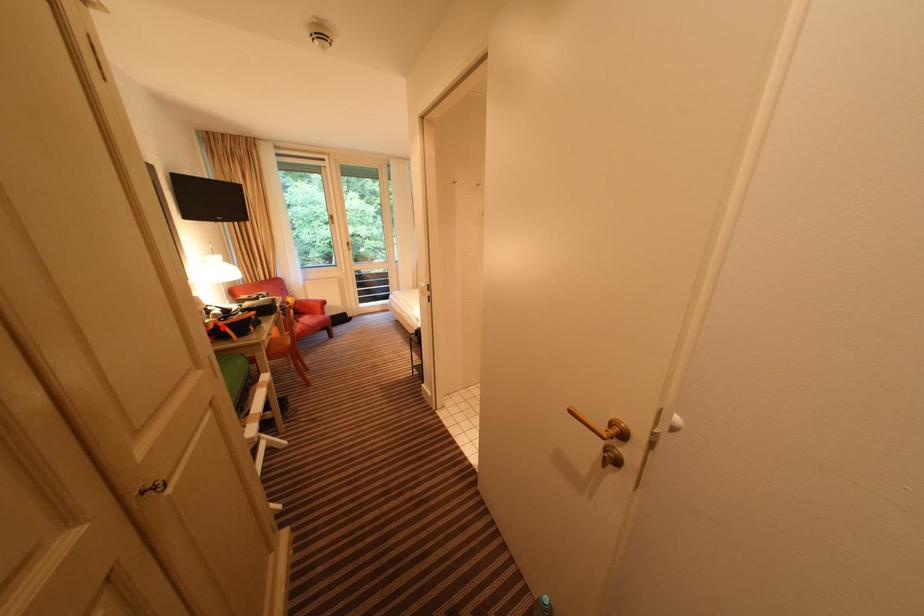
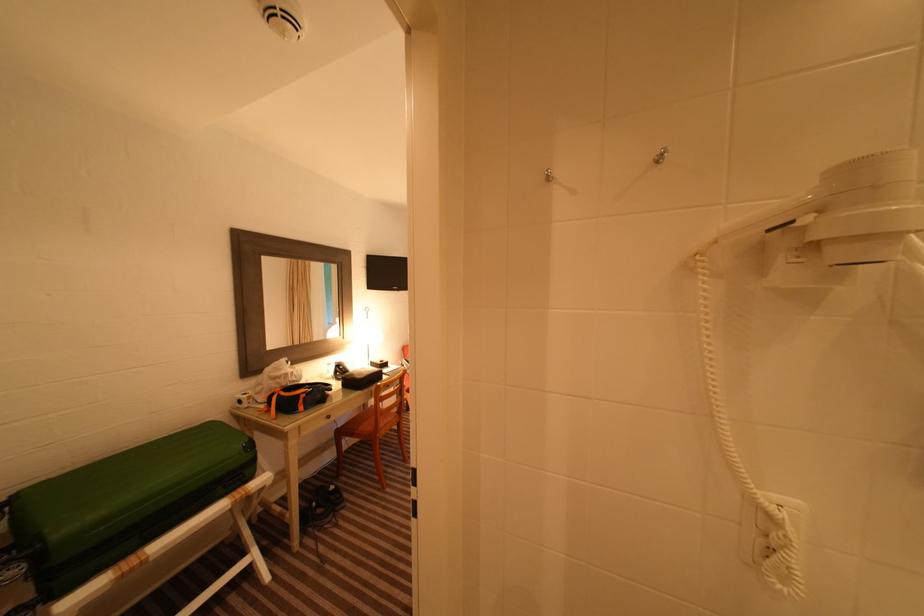
Find the pixel in the second image that matches the highlighted location in the first image.

(280, 397)